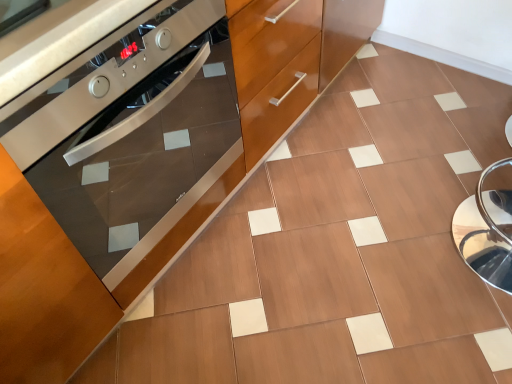
This screenshot has height=384, width=512. In order to click on satin silver oven at left in this screenshot , I will do `click(130, 132)`.

Describe the element at coordinates (130, 132) in the screenshot. The height and width of the screenshot is (384, 512). I see `satin silver oven at left` at that location.

Locate an element on the screen. satin silver oven at left is located at coordinates (130, 132).